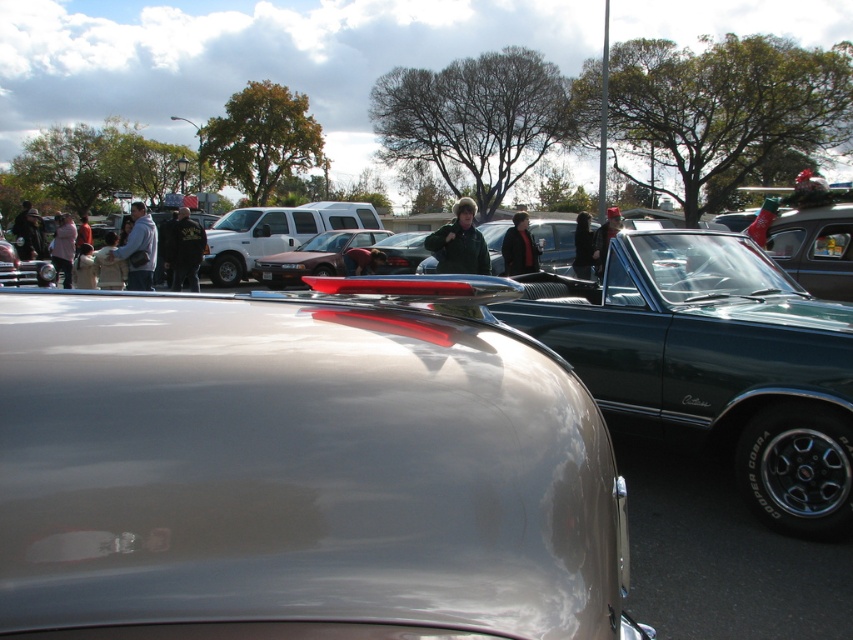
Which is above, denim jacket at left or dark green leather jacket at center?

dark green leather jacket at center is higher up.

Which is more to the left, denim jacket at left or dark green leather jacket at center?

Positioned to the left is denim jacket at left.

Which is in front, point (138, 212) or point (607, 248)?

Point (138, 212) is in front.

At what (x,y) coordinates should I click in order to perform the action: click on denim jacket at left. Please return your answer as a coordinate pair (x, y). This screenshot has height=640, width=853. Looking at the image, I should click on (138, 250).

Is point (4, 516) positioned before point (602, 250)?

Yes, it is in front of point (602, 250).

Can you confirm if satin silver hood at center is wider than dark green leather jacket at center?

Incorrect, satin silver hood at center's width does not surpass dark green leather jacket at center's.

You are a GUI agent. You are given a task and a screenshot of the screen. Output one action in this format:
    pyautogui.click(x=<x>, y=<y>)
    Task: Click on the satin silver hood at center
    The width and height of the screenshot is (853, 640).
    Given the screenshot: What is the action you would take?
    pyautogui.click(x=297, y=474)

Does point (445, 269) come farther from viewer compared to point (602, 253)?

No, it is in front of (602, 253).

You are a GUI agent. You are given a task and a screenshot of the screen. Output one action in this format:
    pyautogui.click(x=<x>, y=<y>)
    Task: Click on the green matte jacket at center
    This screenshot has height=640, width=853.
    Given the screenshot: What is the action you would take?
    pyautogui.click(x=459, y=243)

The image size is (853, 640). What are the coordinates of `green matte jacket at center` in the screenshot? It's located at (459, 243).